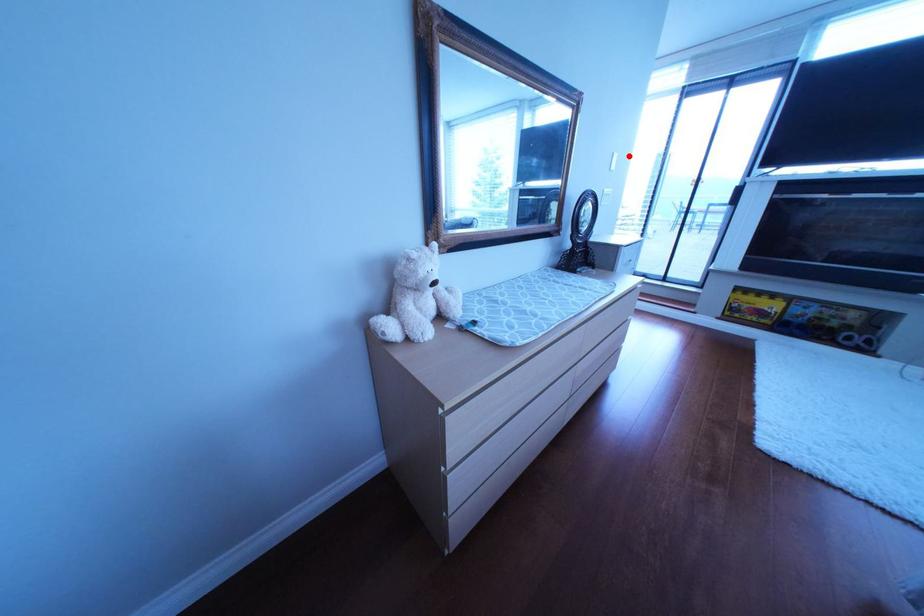
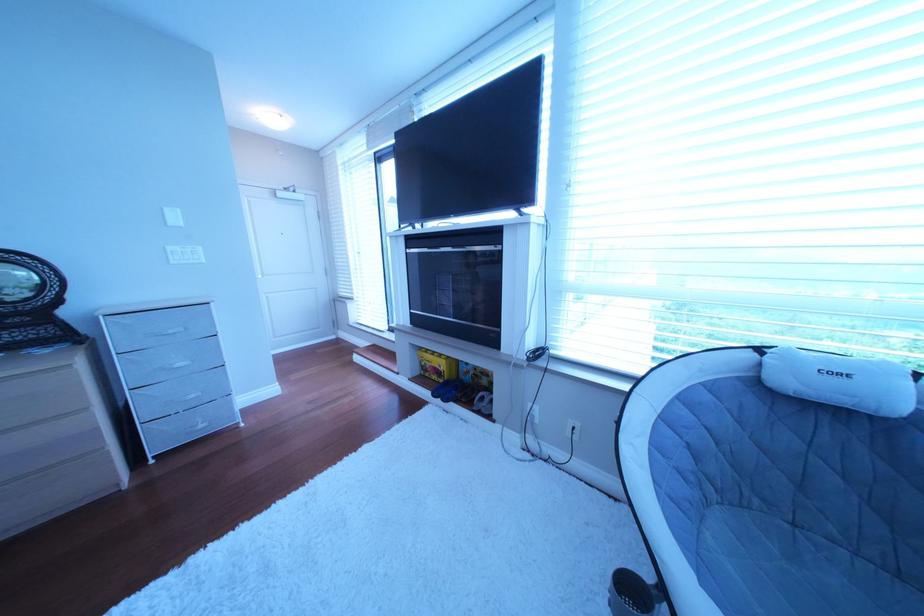
Where in the second image is the point corresponding to the highlighted location from the first image?

(177, 211)